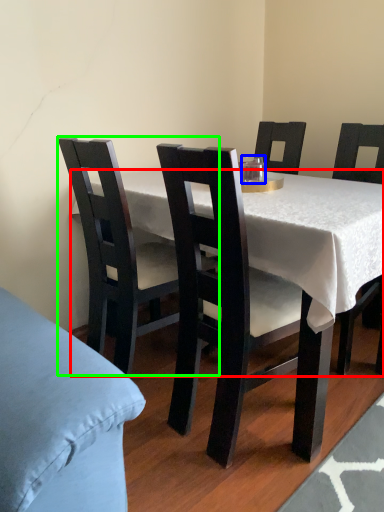
Question: Which is nearer to the desk (highlighted by a red box)? coffee cup (highlighted by a blue box) or chair (highlighted by a green box).

Choices:
 (A) coffee cup
 (B) chair

Answer: (B)